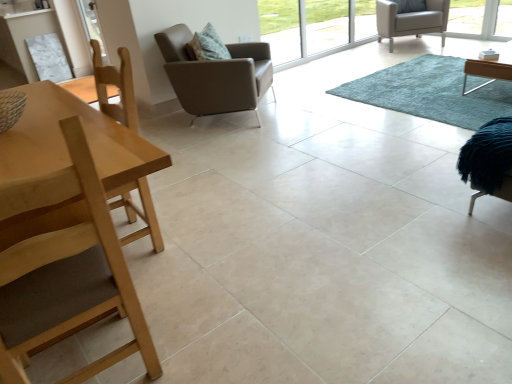
Question: Should I look upward or downward to see light wood table at left?

Choices:
 (A) up
 (B) down

Answer: (A)

Question: Would you consider light wood table at left to be distant from blue shaggy rug at center?

Choices:
 (A) no
 (B) yes

Answer: (B)

Question: Does light wood table at left appear on the left side of blue shaggy rug at center?

Choices:
 (A) yes
 (B) no

Answer: (A)

Question: Can you see light wood table at left touching blue shaggy rug at center?

Choices:
 (A) yes
 (B) no

Answer: (B)

Question: From the image's perspective, is light wood table at left beneath blue shaggy rug at center?

Choices:
 (A) yes
 (B) no

Answer: (A)

Question: Is light wood table at left positioned beyond the bounds of blue shaggy rug at center?

Choices:
 (A) yes
 (B) no

Answer: (A)

Question: Is light wood table at left taller than blue shaggy rug at center?

Choices:
 (A) no
 (B) yes

Answer: (B)

Question: Is blue shaggy rug at center surrounding light brown leather armchair at upper right, the 1th chair when ordered from top to bottom?

Choices:
 (A) yes
 (B) no

Answer: (B)

Question: Considering the relative positions of blue shaggy rug at center and light brown leather armchair at upper right, marked as the 3th chair in a bottom-to-top arrangement, in the image provided, is blue shaggy rug at center in front of light brown leather armchair at upper right, marked as the 3th chair in a bottom-to-top arrangement,?

Choices:
 (A) yes
 (B) no

Answer: (A)

Question: Is blue shaggy rug at center looking in the opposite direction of light brown leather armchair at upper right, placed as the first chair when sorted from back to front?

Choices:
 (A) yes
 (B) no

Answer: (B)

Question: From a real-world perspective, is blue shaggy rug at center over light brown leather armchair at upper right, which appears as the third chair when viewed from the front?

Choices:
 (A) no
 (B) yes

Answer: (A)

Question: Does blue shaggy rug at center turn towards light brown leather armchair at upper right, which appears as the 1th chair when viewed from the right?

Choices:
 (A) yes
 (B) no

Answer: (B)

Question: Is blue shaggy rug at center wider than light brown leather armchair at upper right, the third chair in the left-to-right sequence?

Choices:
 (A) no
 (B) yes

Answer: (B)

Question: Does blue shaggy rug at center appear on the right side of leather-like brown armchair at center, which ranks as the 2th chair in back-to-front order?

Choices:
 (A) yes
 (B) no

Answer: (A)